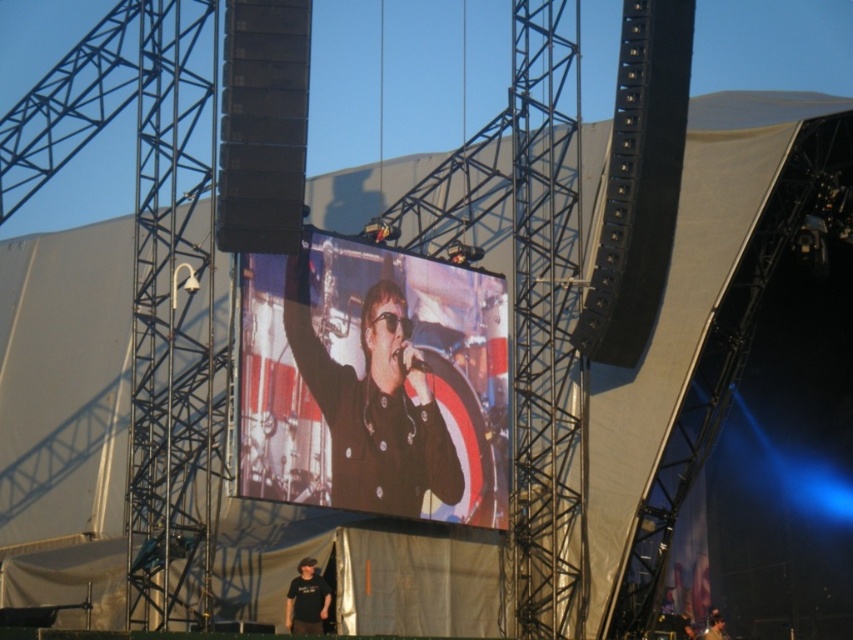
Does black matte jacket at center lie in front of black matte shirt at lower center?

Yes.

Is black matte jacket at center behind black matte shirt at lower center?

That is False.

Who is more forward, (415,456) or (308,630)?

Point (308,630) is in front.

Locate an element on the screen. black matte jacket at center is located at coordinates (373, 403).